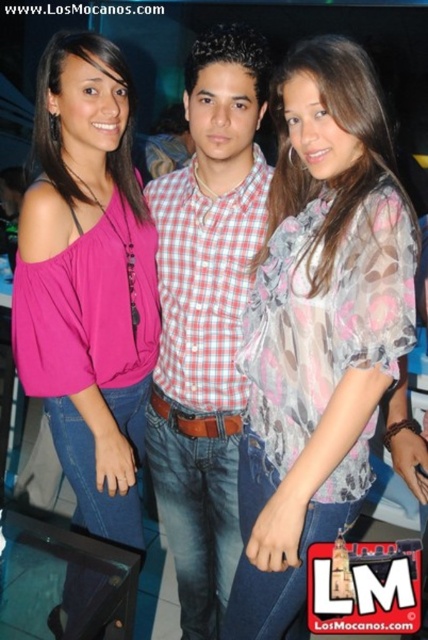
Is translucent floral blouse at center bigger than pink matte top at left?

Correct, translucent floral blouse at center is larger in size than pink matte top at left.

Can you confirm if translucent floral blouse at center is positioned above pink matte top at left?

No.

Who is more forward, (285, 456) or (82, 168)?

Positioned in front is point (285, 456).

Where is `translucent floral blouse at center`? The image size is (428, 640). translucent floral blouse at center is located at coordinates (318, 326).

Does pink matte top at left have a smaller size compared to checkered fabric shirt at center?

Correct, pink matte top at left occupies less space than checkered fabric shirt at center.

Who is positioned more to the left, pink matte top at left or checkered fabric shirt at center?

pink matte top at left is more to the left.

Measure the distance between point (95, 496) and camera.

A distance of 1.53 meters exists between point (95, 496) and camera.

Find the location of a particular element. pink matte top at left is located at coordinates [88, 282].

This screenshot has height=640, width=428. Describe the element at coordinates (318, 326) in the screenshot. I see `translucent floral blouse at center` at that location.

Can you confirm if translucent floral blouse at center is thinner than checkered fabric shirt at center?

No.

Who is more distant from viewer, (335, 266) or (228, 214)?

The point (228, 214) is behind.

I want to click on translucent floral blouse at center, so click(318, 326).